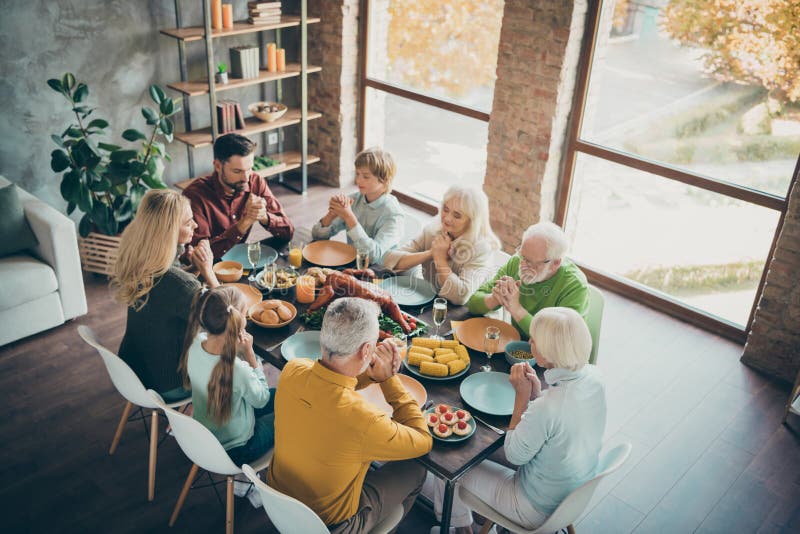
Identify the location of silver utensils. This screenshot has width=800, height=534. 273,252, 269,347, 448,340, 496,425, 424,399.